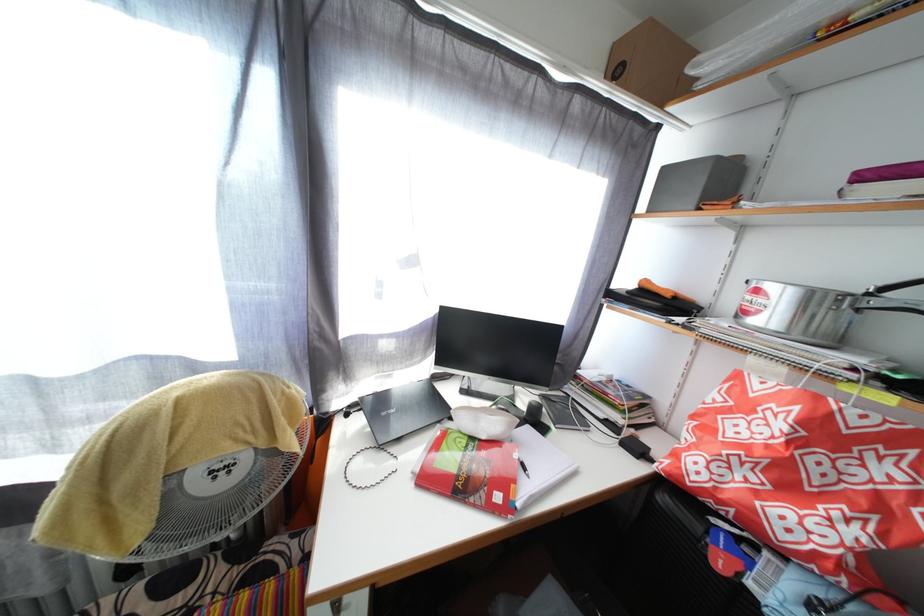
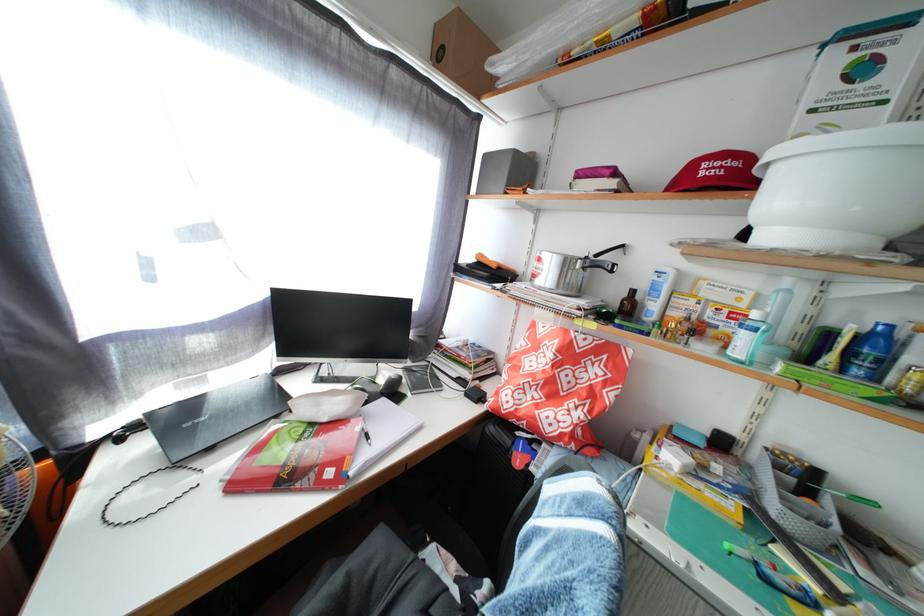
In the second image, find the point that corresponds to point 653,286 in the first image.

(489, 262)